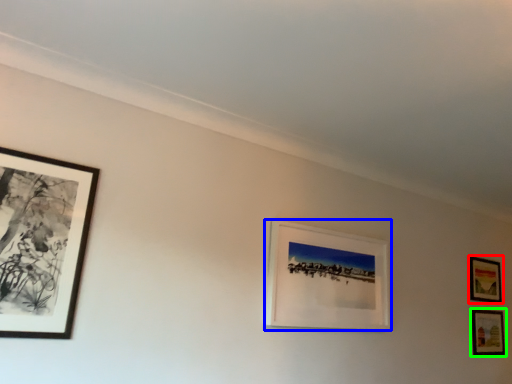
Question: Considering the real-world distances, which object is closest to picture frame (highlighted by a red box)? picture frame (highlighted by a blue box) or picture frame (highlighted by a green box).

Choices:
 (A) picture frame
 (B) picture frame

Answer: (B)